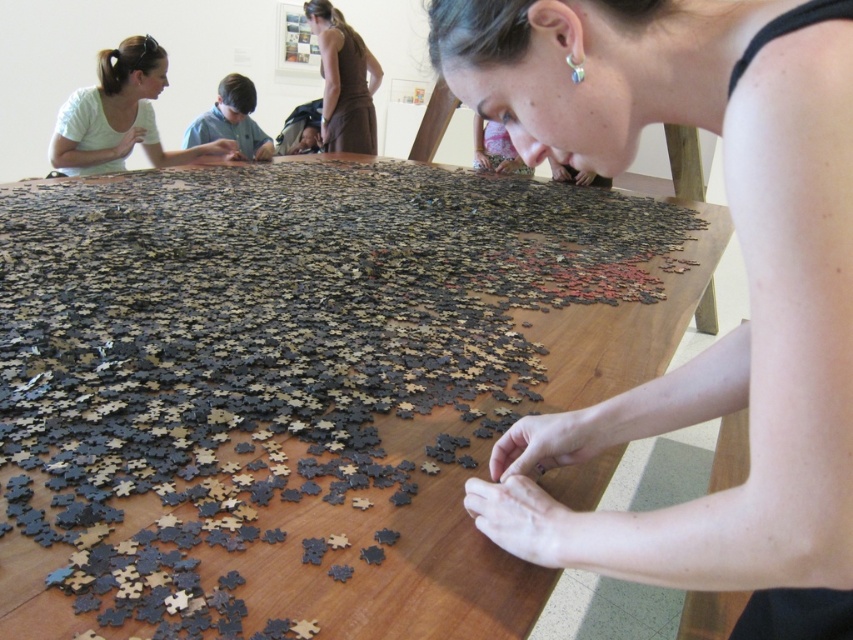
Please describe the position of the matte white shirt at upper left in the image using coordinates.

The matte white shirt at upper left is located at coordinates point (120, 115).

You are a photographer trying to capture the scene of the puzzle assembly. You notice the wooden puzzle pieces at center and the brown fabric dress at upper center. Which object should you focus on first if you want to photograph the taller object?

The wooden puzzle pieces at center should be focused on first because they are taller than the brown fabric dress at upper center according to the description.